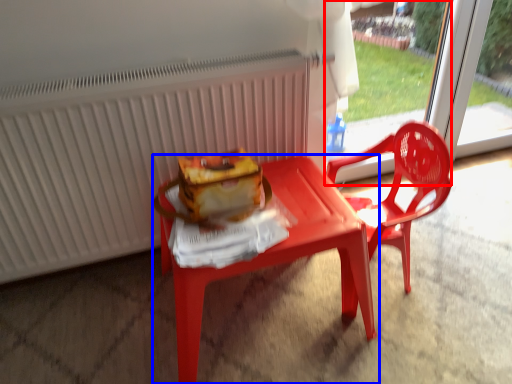
Question: Among these objects, which one is nearest to the camera, screen door (highlighted by a red box) or table (highlighted by a blue box)?

Choices:
 (A) screen door
 (B) table

Answer: (B)